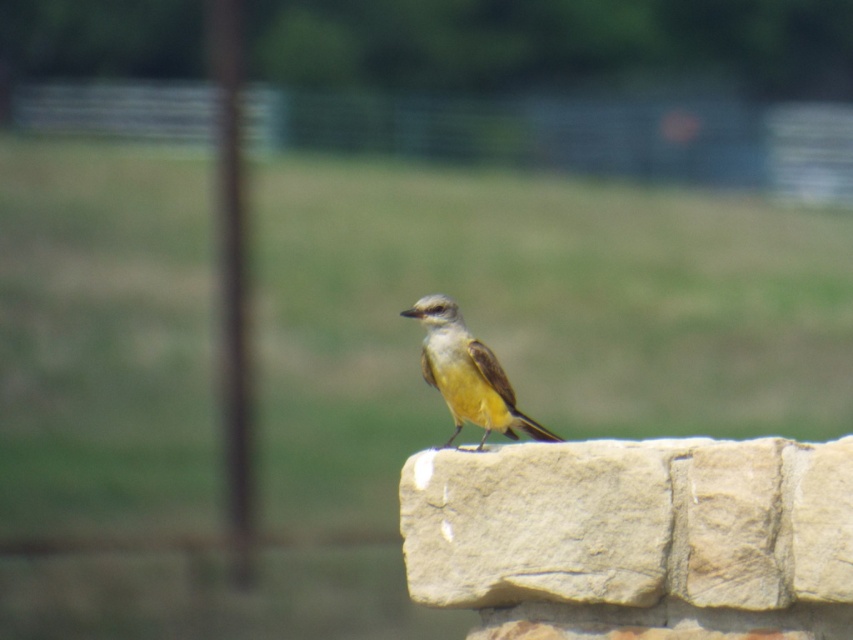
Question: Is the position of beige rough stone at center less distant than that of yellow matte bird at center?

Choices:
 (A) no
 (B) yes

Answer: (B)

Question: Which of the following is the farthest from the observer?

Choices:
 (A) beige rough stone at center
 (B) yellow matte bird at center

Answer: (B)

Question: Does beige rough stone at center have a smaller size compared to yellow matte bird at center?

Choices:
 (A) yes
 (B) no

Answer: (B)

Question: Is beige rough stone at center to the left of yellow matte bird at center from the viewer's perspective?

Choices:
 (A) yes
 (B) no

Answer: (B)

Question: Among these objects, which one is nearest to the camera?

Choices:
 (A) beige rough stone at center
 (B) yellow matte bird at center

Answer: (A)